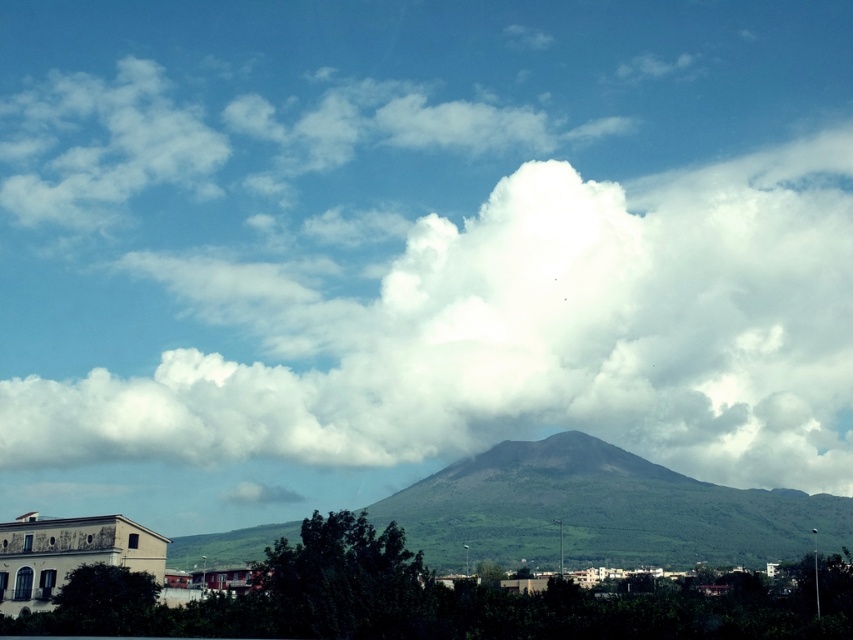
Question: Which point appears closest to the camera in this image?

Choices:
 (A) (608, 513)
 (B) (737, 317)

Answer: (A)

Question: Is white fluffy cloud at upper center wider than green matte mountain at center?

Choices:
 (A) no
 (B) yes

Answer: (B)

Question: Which point is farther to the camera?

Choices:
 (A) (405, 492)
 (B) (141, 401)

Answer: (B)

Question: Can you confirm if white fluffy cloud at upper center is positioned below green matte mountain at center?

Choices:
 (A) yes
 (B) no

Answer: (B)

Question: Is white fluffy cloud at upper center thinner than green matte mountain at center?

Choices:
 (A) no
 (B) yes

Answer: (A)